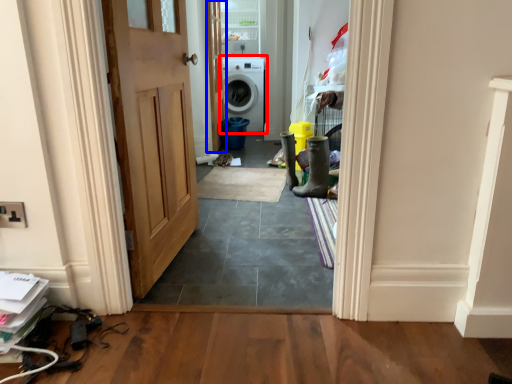
Question: Among these objects, which one is nearest to the camera, washing machine (highlighted by a red box) or door (highlighted by a blue box)?

Choices:
 (A) washing machine
 (B) door

Answer: (B)